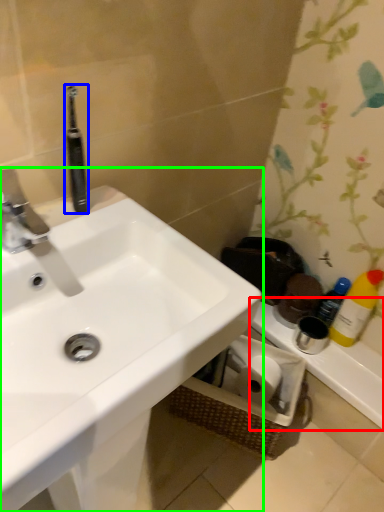
Question: Which is nearer to the counter top (highlighted by a red box)? toothbrush (highlighted by a blue box) or sink (highlighted by a green box).

Choices:
 (A) toothbrush
 (B) sink

Answer: (B)